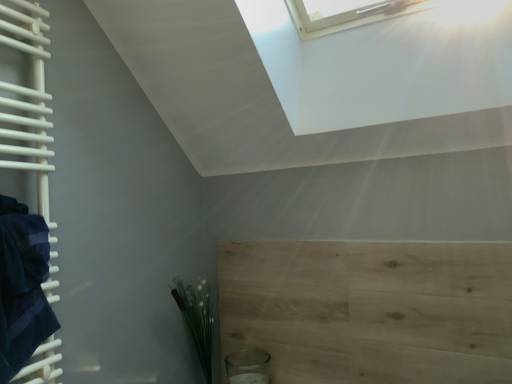
Question: In terms of width, does green matte plant at lower left look wider or thinner when compared to light wood plywood at lower right?

Choices:
 (A) wide
 (B) thin

Answer: (A)

Question: Is green matte plant at lower left in front of or behind light wood plywood at lower right in the image?

Choices:
 (A) front
 (B) behind

Answer: (B)

Question: Which object is positioned farthest from the light wood plywood at lower right?

Choices:
 (A) green matte plant at lower left
 (B) dark blue towel at left

Answer: (B)

Question: Which object is the farthest from the green matte plant at lower left?

Choices:
 (A) light wood plywood at lower right
 (B) dark blue towel at left

Answer: (B)